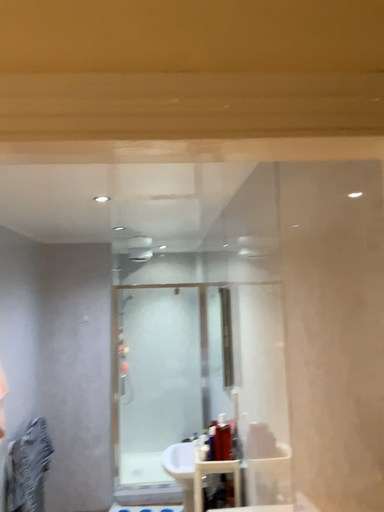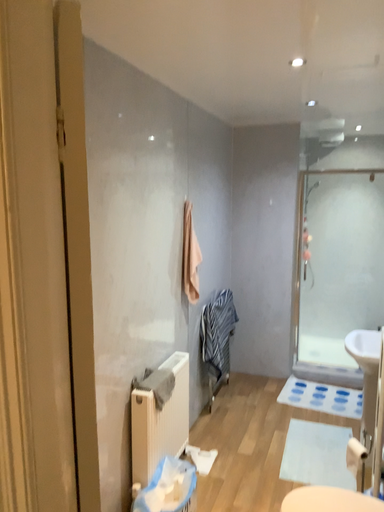
Question: How did the camera likely rotate when shooting the video?

Choices:
 (A) rotated right
 (B) rotated left

Answer: (B)